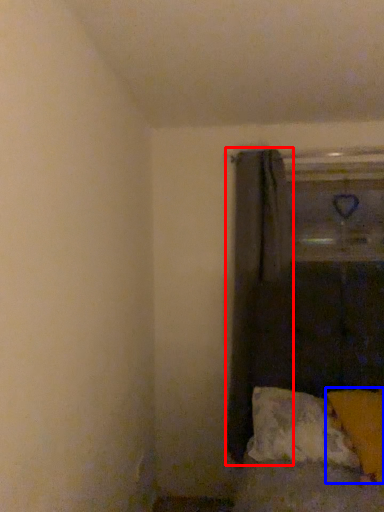
Question: Which object appears closest to the camera in this image, curtain (highlighted by a red box) or pillow (highlighted by a blue box)?

Choices:
 (A) curtain
 (B) pillow

Answer: (B)